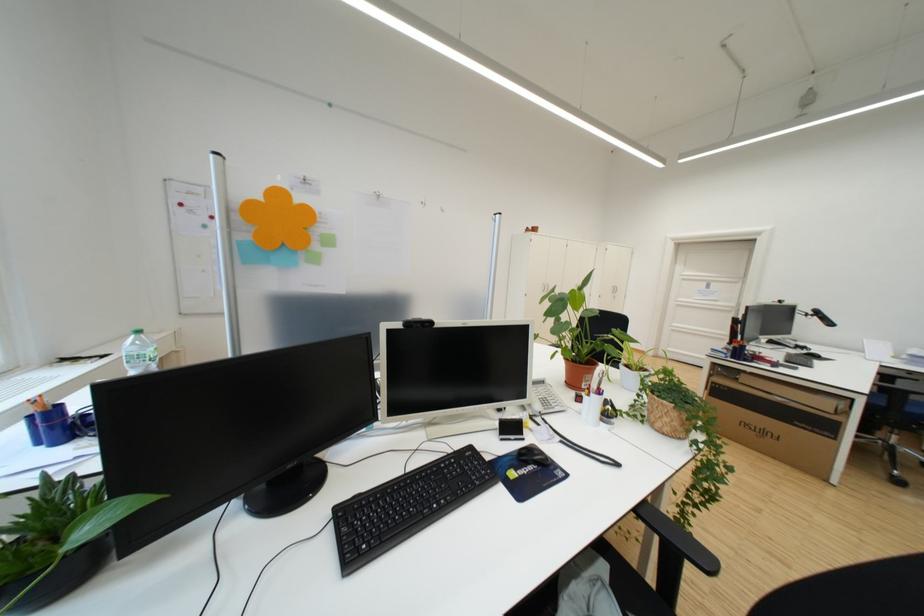
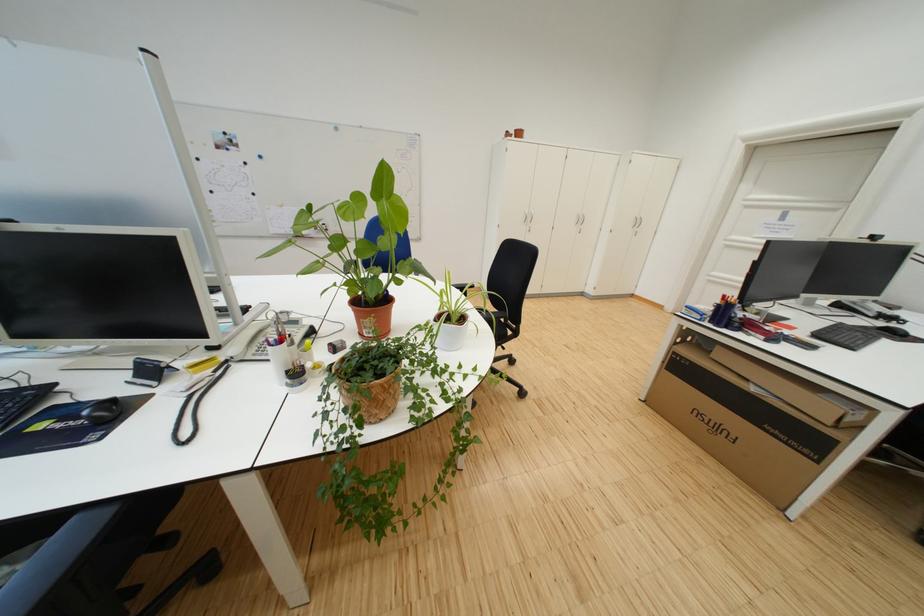
Locate, in the second image, the point that corresponds to (774,435) in the first image.

(730, 431)